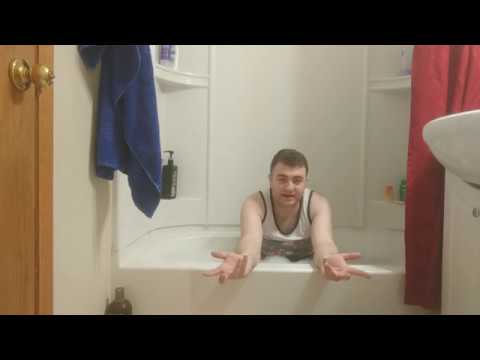
This screenshot has height=360, width=480. I want to click on red shower curtain, so click(x=449, y=65).